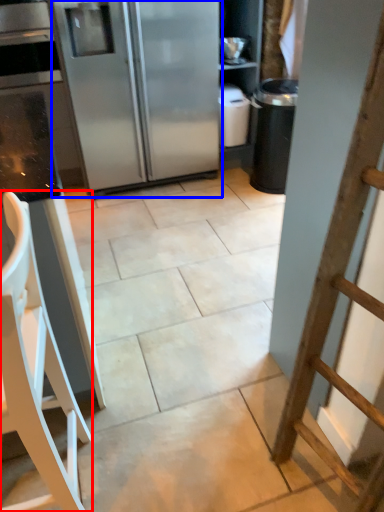
Question: Among these objects, which one is farthest to the camera, furniture (highlighted by a red box) or refrigerator (highlighted by a blue box)?

Choices:
 (A) furniture
 (B) refrigerator

Answer: (B)